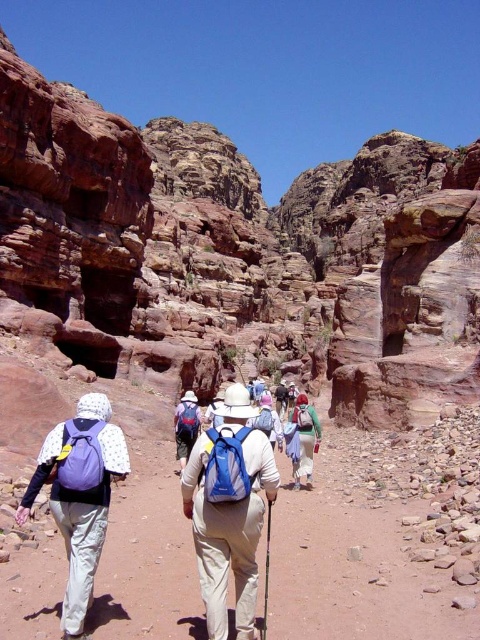
Question: Is green fabric backpack at center closer to camera compared to matte blue backpack at center?

Choices:
 (A) no
 (B) yes

Answer: (B)

Question: Is blue fabric backpack at center bigger than green fabric backpack at center?

Choices:
 (A) yes
 (B) no

Answer: (B)

Question: Does blue fabric backpack at center appear on the left side of light brown leather backpack at center?

Choices:
 (A) yes
 (B) no

Answer: (A)

Question: Based on their relative distances, which object is farther from the blue fabric backpack at center?

Choices:
 (A) matte blue backpack at center
 (B) purple fabric backpack at center-left
 (C) green fabric backpack at center

Answer: (A)

Question: Which object appears closest to the camera in this image?

Choices:
 (A) green fabric backpack at center
 (B) light brown leather backpack at center
 (C) matte blue backpack at center

Answer: (A)

Question: Which point appears farthest from the camera in this image?

Choices:
 (A) (284, 394)
 (B) (193, 476)

Answer: (A)